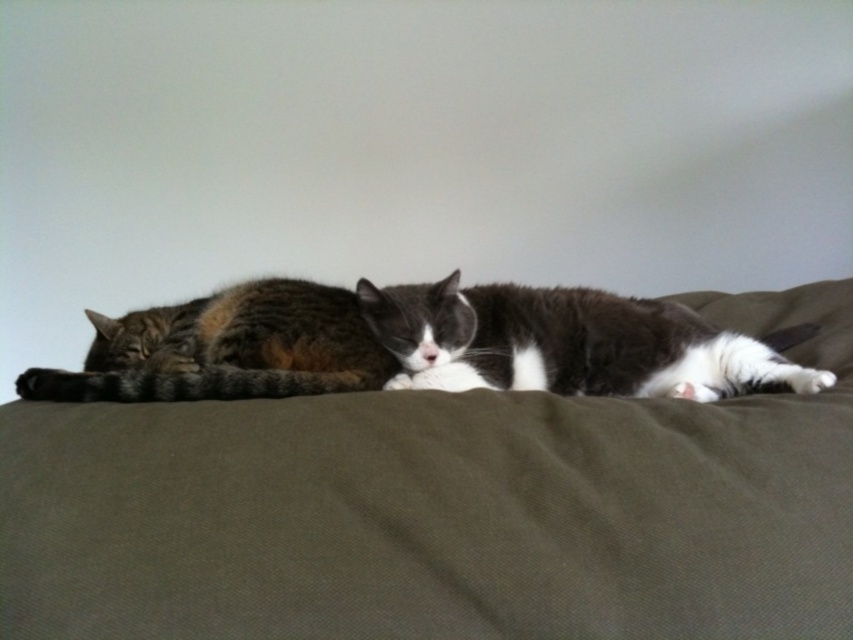
Question: Is olive green fabric couch at center above tabby fur cat at left?

Choices:
 (A) no
 (B) yes

Answer: (A)

Question: Can you confirm if white-gray fur cat at center is bigger than tabby fur cat at left?

Choices:
 (A) no
 (B) yes

Answer: (B)

Question: Which object is positioned closest to the olive green fabric couch at center?

Choices:
 (A) white-gray fur cat at center
 (B) tabby fur cat at left

Answer: (A)

Question: Is olive green fabric couch at center smaller than white-gray fur cat at center?

Choices:
 (A) no
 (B) yes

Answer: (A)

Question: Which object is the farthest from the white-gray fur cat at center?

Choices:
 (A) olive green fabric couch at center
 (B) tabby fur cat at left

Answer: (B)

Question: Considering the real-world distances, which object is closest to the white-gray fur cat at center?

Choices:
 (A) olive green fabric couch at center
 (B) tabby fur cat at left

Answer: (A)